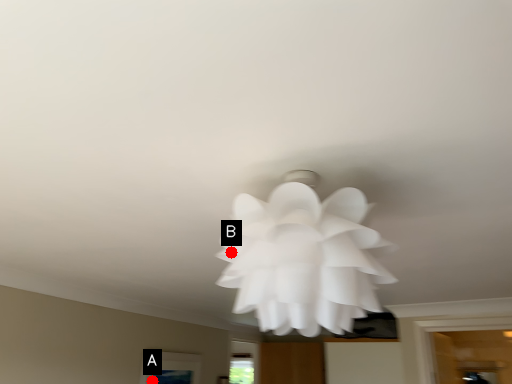
Question: Two points are circled on the image, labeled by A and B beside each circle. Which point is closer to the camera taking this photo?

Choices:
 (A) A is closer
 (B) B is closer

Answer: (B)